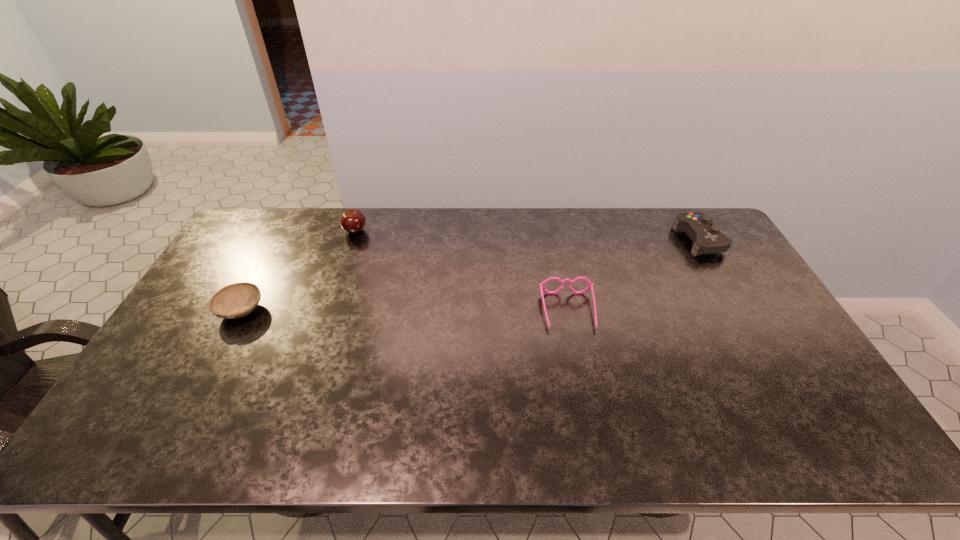
Locate an element on the screen. apple is located at coordinates (352, 221).

You are a GUI agent. You are given a task and a screenshot of the screen. Output one action in this format:
    pyautogui.click(x=<x>, y=<y>)
    Task: Click on the rightmost object
    
    Given the screenshot: What is the action you would take?
    pyautogui.click(x=706, y=238)

This screenshot has height=540, width=960. What are the coordinates of `the third tallest object` in the screenshot? It's located at (541, 285).

Where is `the second object from right to left`? This screenshot has height=540, width=960. the second object from right to left is located at coordinates (541, 285).

Find the location of `the leftmost object`. the leftmost object is located at coordinates (234, 301).

Where is `the shortest object`? The width and height of the screenshot is (960, 540). the shortest object is located at coordinates (234, 301).

This screenshot has width=960, height=540. I want to click on blank area located 0.050m on the back of the apple, so click(360, 216).

Image resolution: width=960 pixels, height=540 pixels. I want to click on free space located on the front of the rightmost object, so click(756, 339).

This screenshot has width=960, height=540. Find the location of `vacant space located 0.060m on the arms of the second shortest object`. vacant space located 0.060m on the arms of the second shortest object is located at coordinates (576, 349).

At what (x,y) coordinates should I click in order to perform the action: click on vacant area situated 0.220m on the front of the bowl. Please return your answer as a coordinate pair (x, y). Looking at the image, I should click on (196, 395).